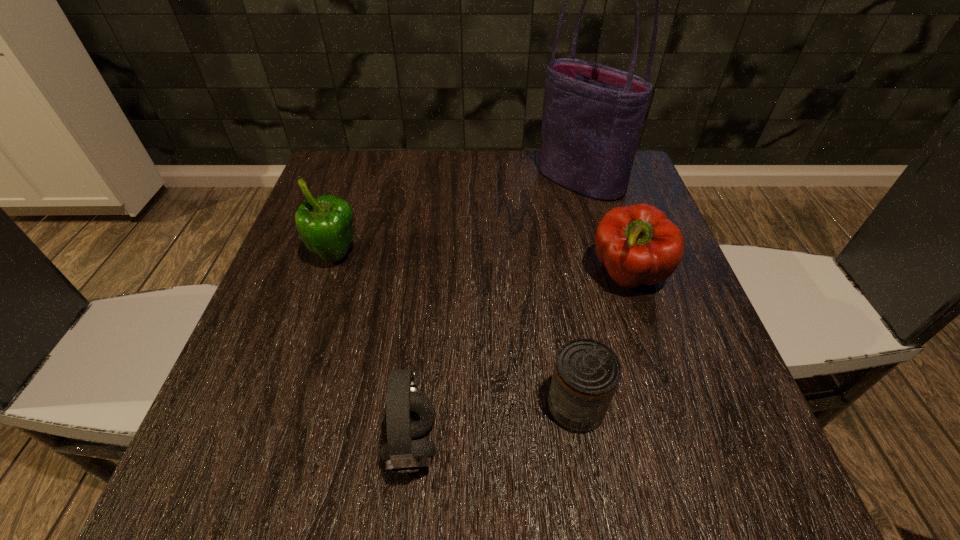
This screenshot has height=540, width=960. Find the location of `free space between the left bell pepper and the tote bag`. free space between the left bell pepper and the tote bag is located at coordinates (458, 218).

Identify the location of free area in between the shortest object and the farthest object. The image size is (960, 540). (578, 293).

At what (x,y) coordinates should I click in order to perform the action: click on unoccupied area between the right bell pepper and the leftmost object. Please return your answer as a coordinate pair (x, y). The height and width of the screenshot is (540, 960). Looking at the image, I should click on (482, 266).

You are a GUI agent. You are given a task and a screenshot of the screen. Output one action in this format:
    pyautogui.click(x=<x>, y=<y>)
    Task: Click on the object that is the fourth closest to the farthest object
    This screenshot has height=540, width=960.
    Given the screenshot: What is the action you would take?
    pyautogui.click(x=408, y=413)

Select which object appears as the second closest to the tallest object. Please provide its 2D coordinates. Your answer should be formatted as a tuple, i.e. [(x, y)], where the tuple contains the x and y coordinates of a point satisfying the conditions above.

[(325, 223)]

You are a GUI agent. You are given a task and a screenshot of the screen. Output one action in this format:
    pyautogui.click(x=<x>, y=<y>)
    Task: Click on the vacant space that satisfies the following two spatial constraints: 1. on the back side of the left bell pepper; 2. on the left side of the farthest object
    Image resolution: width=960 pixels, height=540 pixels.
    Given the screenshot: What is the action you would take?
    pyautogui.click(x=361, y=180)

Locate an element on the screen. The height and width of the screenshot is (540, 960). vacant space that satisfies the following two spatial constraints: 1. on the back side of the shortest object; 2. on the left side of the tote bag is located at coordinates (539, 180).

The width and height of the screenshot is (960, 540). Identify the location of free space that satisfies the following two spatial constraints: 1. on the front side of the right bell pepper; 2. on the ear cups of the fourth object from right to left. (683, 444).

Find the location of a particular element. The width and height of the screenshot is (960, 540). vacant position in the image that satisfies the following two spatial constraints: 1. on the front side of the right bell pepper; 2. on the ear cups of the headset is located at coordinates (683, 444).

At what (x,y) coordinates should I click in order to perform the action: click on free space that satisfies the following two spatial constraints: 1. on the front side of the can; 2. on the ear cups of the fourth object from right to left. Please return your answer as a coordinate pair (x, y). Looking at the image, I should click on (582, 444).